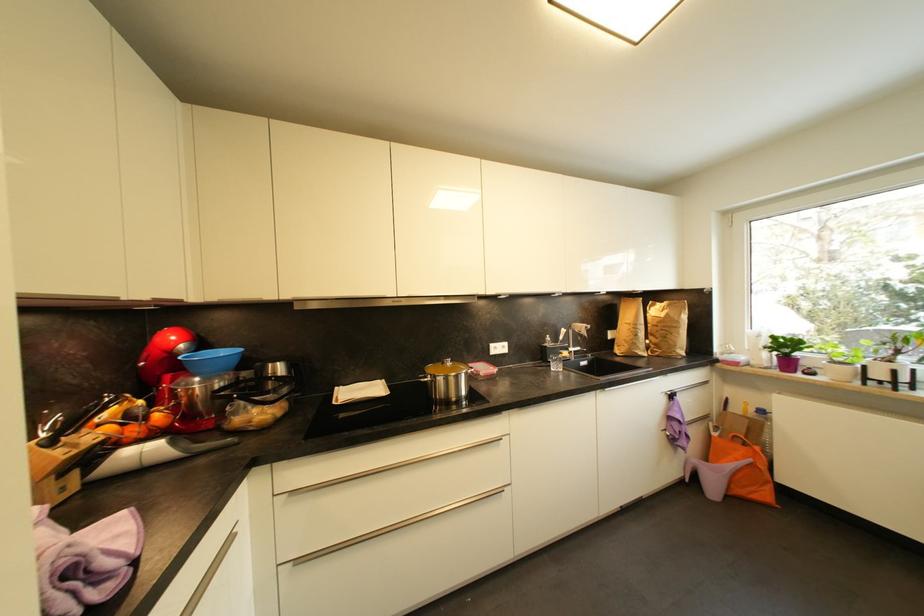
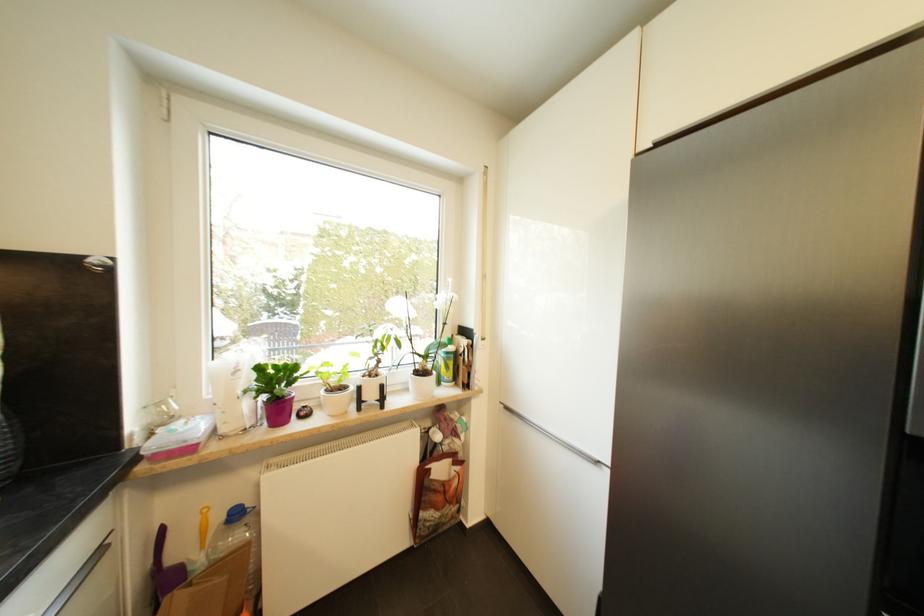
Where in the second image is the point corresponding to point (740, 366) from the first image?

(195, 451)